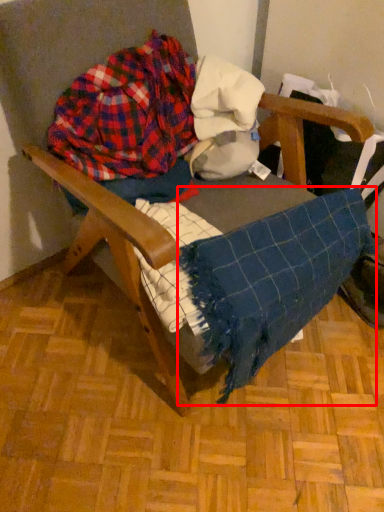
Question: From the image's perspective, where is blanket (annotated by the red box) located in relation to flannel in the image?

Choices:
 (A) above
 (B) below

Answer: (B)